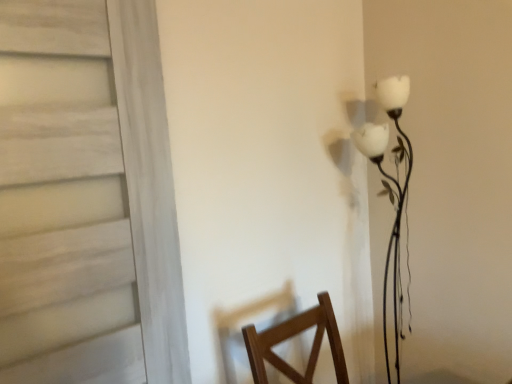
Question: From the image's perspective, is white wood door at left below white matte floral lamp at right?

Choices:
 (A) no
 (B) yes

Answer: (A)

Question: From a real-world perspective, is white wood door at left on white matte floral lamp at right?

Choices:
 (A) no
 (B) yes

Answer: (B)

Question: Would you consider white wood door at left to be distant from white matte floral lamp at right?

Choices:
 (A) yes
 (B) no

Answer: (B)

Question: Does white wood door at left have a greater height compared to white matte floral lamp at right?

Choices:
 (A) no
 (B) yes

Answer: (A)

Question: Does white wood door at left have a greater width compared to white matte floral lamp at right?

Choices:
 (A) yes
 (B) no

Answer: (B)

Question: Can you confirm if white wood door at left is bigger than white matte floral lamp at right?

Choices:
 (A) yes
 (B) no

Answer: (A)

Question: Is white matte floral lamp at right oriented away from white wood door at left?

Choices:
 (A) yes
 (B) no

Answer: (B)

Question: Does white matte floral lamp at right have a greater height compared to white wood door at left?

Choices:
 (A) no
 (B) yes

Answer: (B)

Question: Is white matte floral lamp at right not near white wood door at left?

Choices:
 (A) no
 (B) yes

Answer: (A)

Question: Does white matte floral lamp at right have a smaller size compared to white wood door at left?

Choices:
 (A) yes
 (B) no

Answer: (A)

Question: Is white matte floral lamp at right positioned before white wood door at left?

Choices:
 (A) no
 (B) yes

Answer: (A)

Question: Is white matte floral lamp at right at the left side of white wood door at left?

Choices:
 (A) no
 (B) yes

Answer: (A)

Question: Does point (40, 4) appear closer or farther from the camera than point (358, 148)?

Choices:
 (A) farther
 (B) closer

Answer: (B)